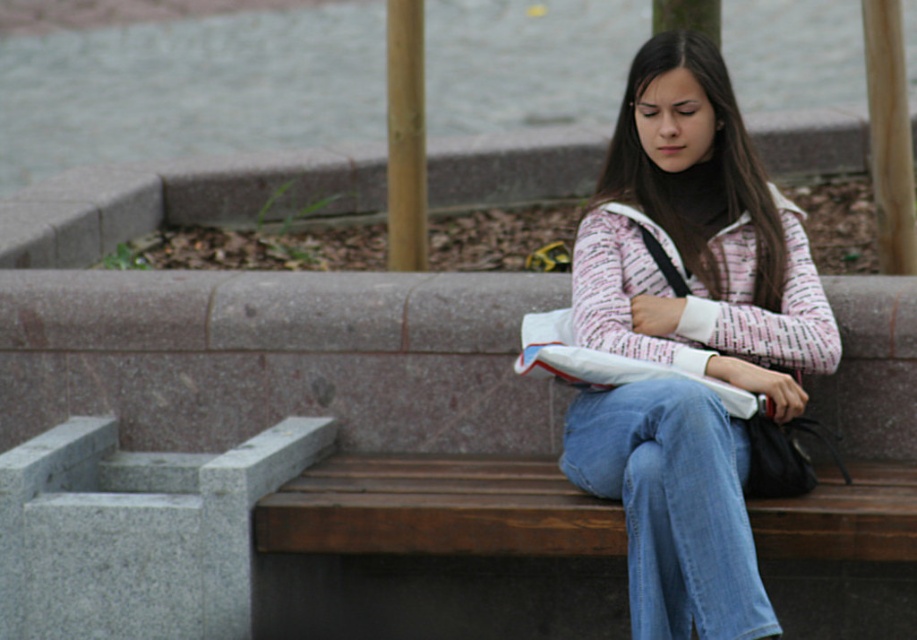
Question: Which is nearer to the denim at right?

Choices:
 (A) wooden bench at center
 (B) pink textured sweater at center

Answer: (B)

Question: Which point appears farthest from the camera in this image?

Choices:
 (A) (693, 232)
 (B) (264, 561)

Answer: (A)

Question: Does wooden bench at center have a lesser width compared to denim at right?

Choices:
 (A) yes
 (B) no

Answer: (B)

Question: Can you confirm if pink textured sweater at center is wider than denim at right?

Choices:
 (A) no
 (B) yes

Answer: (B)

Question: Among these points, which one is nearest to the camera?

Choices:
 (A) (250, 492)
 (B) (735, 154)
 (C) (716, 445)

Answer: (C)

Question: Is pink textured sweater at center closer to camera compared to denim at right?

Choices:
 (A) yes
 (B) no

Answer: (B)